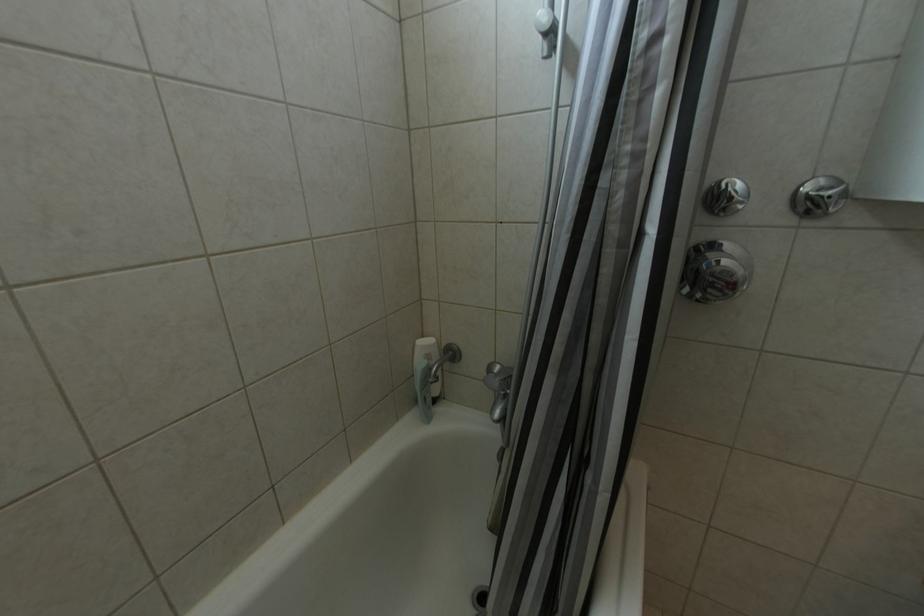
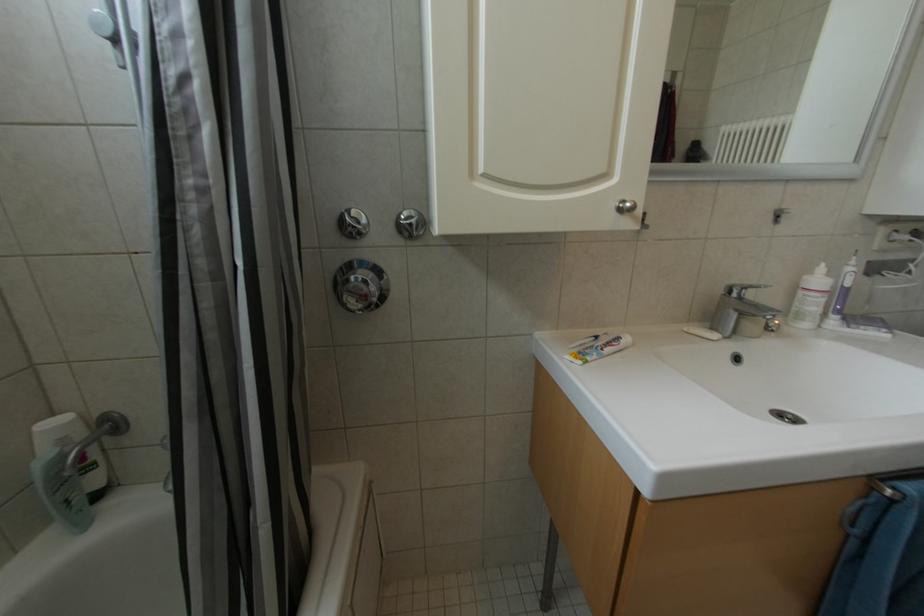
Question: The first image is from the beginning of the video and the second image is from the end. How did the camera likely rotate when shooting the video?

Choices:
 (A) Left
 (B) Right
 (C) Up
 (D) Down

Answer: (B)